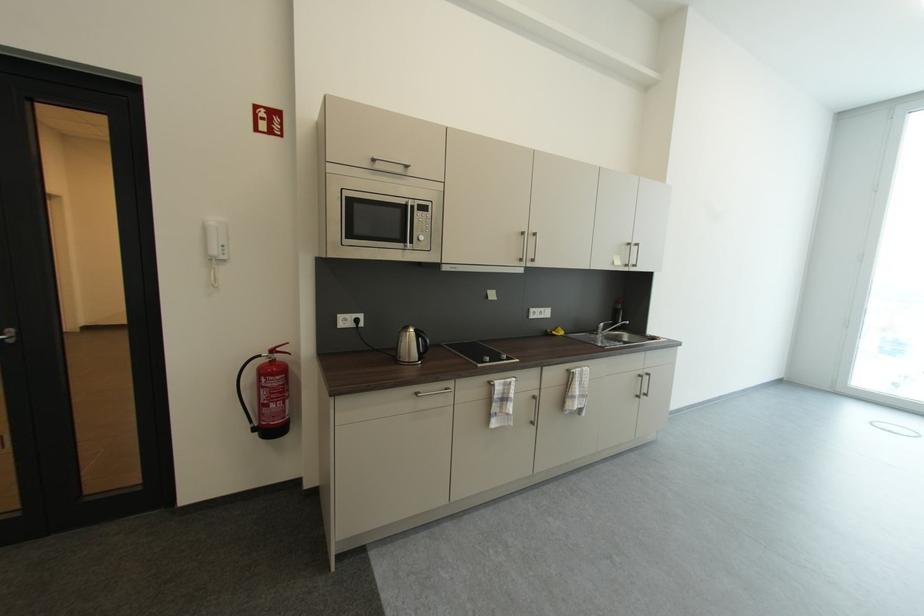
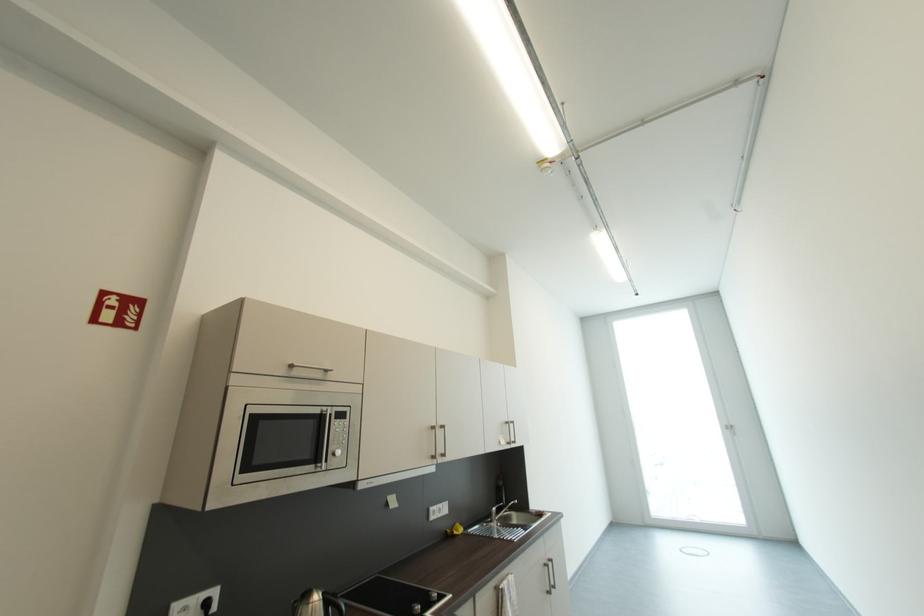
Question: I am providing you with two images of the same scene from different viewpoints. Which of the following objects are not visible in image2?

Choices:
 (A) metal faucet handle
 (B) white power outlet
 (C) silver microwave dial
 (D) none of these

Answer: (D)